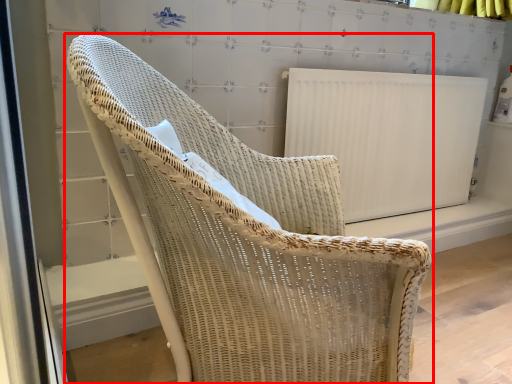
Question: Observing the image, what is the correct spatial positioning of chair (annotated by the red box) in reference to radiator?

Choices:
 (A) right
 (B) left

Answer: (B)